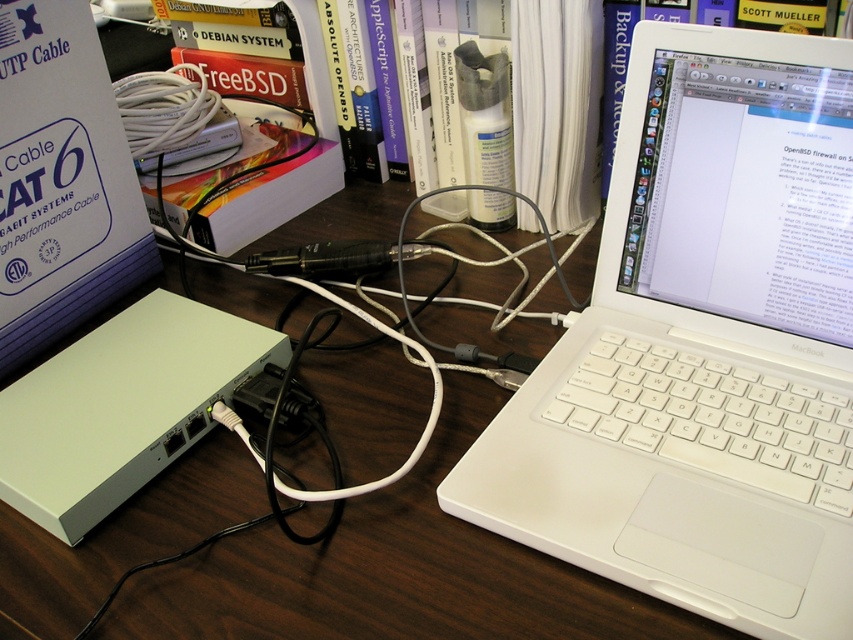
You are setting up a new monitor that is 20 inches wide. You want to place it next to the white plastic laptop at center on the wooden table at center. Considering the width of the laptop and the table, will there be enough space for the monitor on the table?

The white plastic laptop at center has a lesser width compared to wooden table at center, meaning the table is wider. Since the monitor is 20 inches wide, and the table has extra space beyond the laptop, there should be enough room to place the monitor next to the white plastic laptop at center on the wooden table at center.

From the picture: You are setting up a desk and want to place a white plastic laptop at center and a wooden table at center. Since both are at the center, how can you tell which one is closer to you?

The white plastic laptop at center is closer to the viewer than the wooden table at center, so you can identify it by its proximity.

From the picture: Where is the white plastic laptop at center located in the image?

The white plastic laptop at center is located at point (701, 348) in the image.